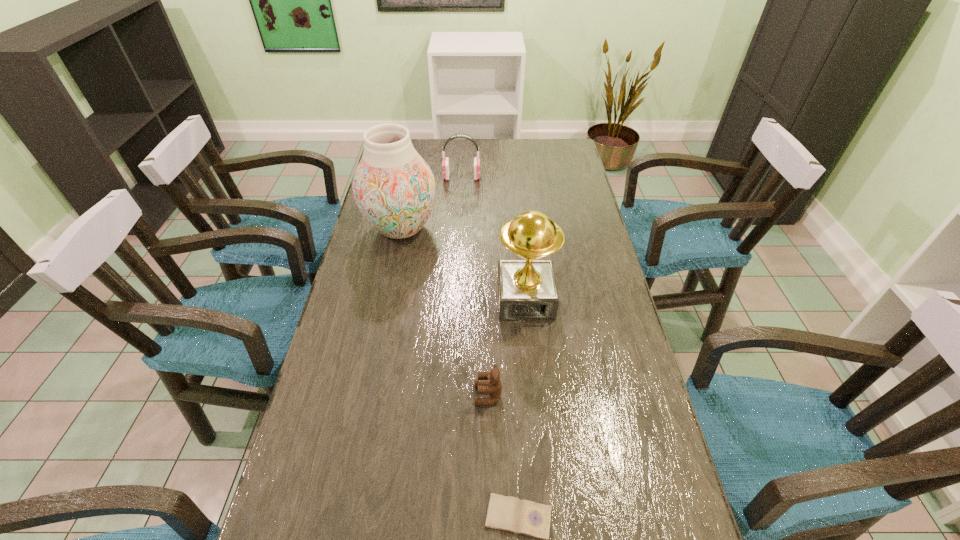
The height and width of the screenshot is (540, 960). Find the location of `vase`. vase is located at coordinates (394, 188).

At what (x,y) coordinates should I click in order to perform the action: click on award. Please return your answer as a coordinate pair (x, y). Looking at the image, I should click on (527, 291).

The height and width of the screenshot is (540, 960). In order to click on the farthest object in this screenshot , I will do `click(445, 164)`.

Image resolution: width=960 pixels, height=540 pixels. What are the coordinates of `earphone` in the screenshot? It's located at (445, 164).

This screenshot has height=540, width=960. What are the coordinates of `the fourth tallest object` in the screenshot? It's located at (493, 387).

Where is `teddy bear`? teddy bear is located at coordinates (493, 387).

This screenshot has height=540, width=960. In order to click on free space located 0.300m on the right of the fourth nearest object in this screenshot , I will do `click(528, 228)`.

This screenshot has width=960, height=540. Find the location of `vacant space located on the front-facing side of the third nearest object`. vacant space located on the front-facing side of the third nearest object is located at coordinates (534, 390).

Where is `free space located 0.210m on the outer surface of the farthest object`? free space located 0.210m on the outer surface of the farthest object is located at coordinates (534, 177).

Image resolution: width=960 pixels, height=540 pixels. I want to click on vacant space located on the face of the second nearest object, so click(x=344, y=395).